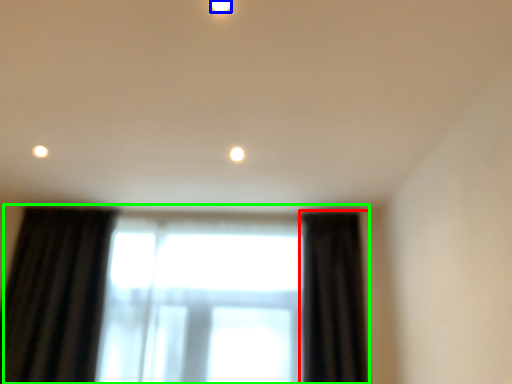
Question: Which is nearer to the curtain (highlighted by a red box)? lighting (highlighted by a blue box) or window (highlighted by a green box).

Choices:
 (A) lighting
 (B) window

Answer: (B)